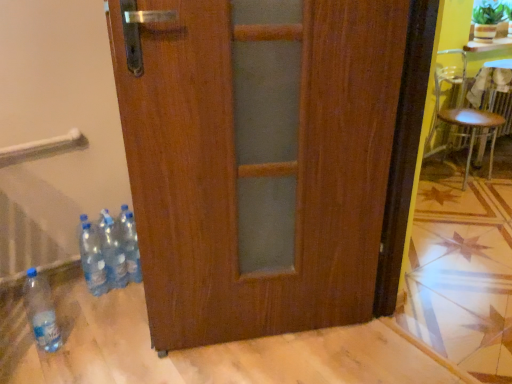
Where is `spots to the right of transparent plastic bottle at lower left, positioned as the fourth bottle in right-to-left order`? The height and width of the screenshot is (384, 512). spots to the right of transparent plastic bottle at lower left, positioned as the fourth bottle in right-to-left order is located at coordinates (91, 345).